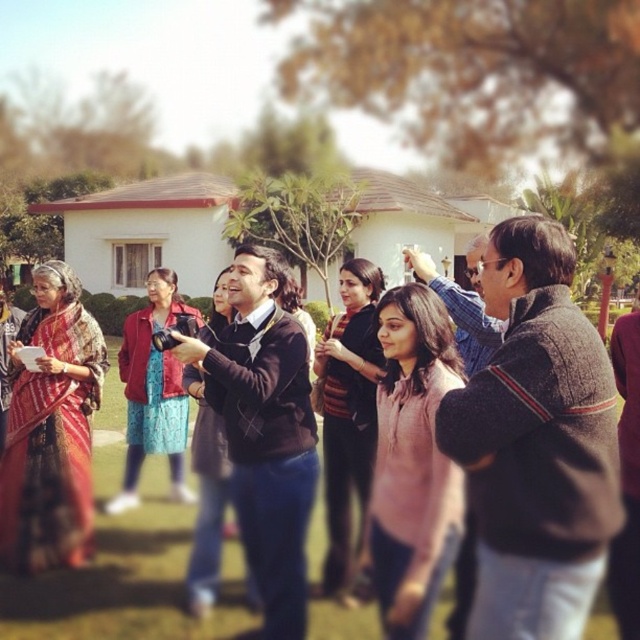
Question: From the image, what is the correct spatial relationship of dark brown woolen sweater at center in relation to dark brown sweater at center?

Choices:
 (A) left
 (B) right

Answer: (B)

Question: Which point is closer to the camera taking this photo?

Choices:
 (A) (477, 627)
 (B) (144, 586)

Answer: (A)

Question: Is dark brown leather jacket at center positioned at the back of dark brown sweater at center?

Choices:
 (A) yes
 (B) no

Answer: (A)

Question: Which point is closer to the camera taking this photo?

Choices:
 (A) (96, 529)
 (B) (598, 342)

Answer: (B)

Question: Among these objects, which one is nearest to the camera?

Choices:
 (A) dark brown leather jacket at center
 (B) dark brown woolen sweater at center

Answer: (B)

Question: Can you confirm if dark brown woolen sweater at center is wider than dark brown leather jacket at center?

Choices:
 (A) yes
 (B) no

Answer: (B)